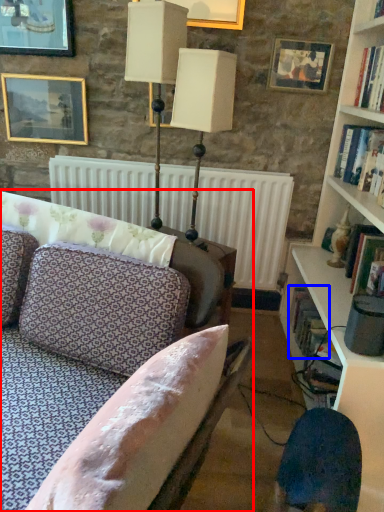
Question: Which point is further to the camera, studio couch (highlighted by a red box) or book (highlighted by a blue box)?

Choices:
 (A) studio couch
 (B) book

Answer: (B)